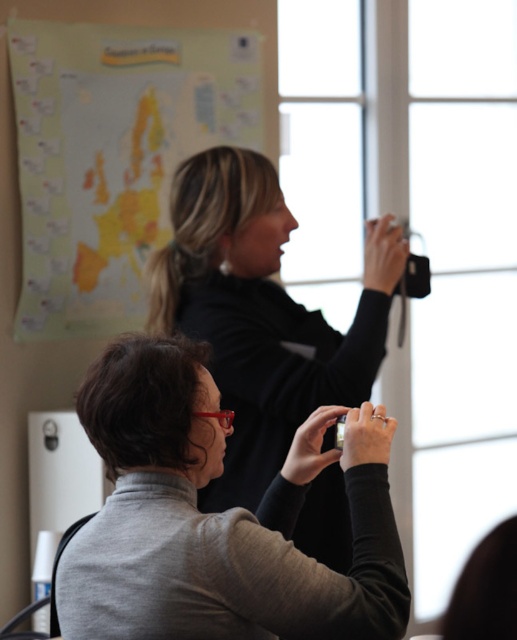
Between gray matte turtleneck at lower left and black matte camera at upper center, which one is positioned higher?

black matte camera at upper center is higher up.

Image resolution: width=517 pixels, height=640 pixels. In order to click on gray matte turtleneck at lower left in this screenshot , I will do `click(219, 516)`.

Between yellow matte map at upper left and black matte camera at upper center, which one appears on the left side from the viewer's perspective?

Positioned to the left is yellow matte map at upper left.

Who is more forward, (x=120, y=314) or (x=389, y=269)?

Point (x=389, y=269) is in front.

Which is behind, point (127, 145) or point (225, 476)?

Positioned behind is point (127, 145).

The height and width of the screenshot is (640, 517). I want to click on yellow matte map at upper left, so click(114, 156).

Is gray matte turtleneck at lower left wider than yellow matte map at upper left?

In fact, gray matte turtleneck at lower left might be narrower than yellow matte map at upper left.

Is gray matte turtleneck at lower left further to camera compared to yellow matte map at upper left?

No, it is not.

What do you see at coordinates (219, 516) in the screenshot?
I see `gray matte turtleneck at lower left` at bounding box center [219, 516].

Locate an element on the screen. gray matte turtleneck at lower left is located at coordinates (219, 516).